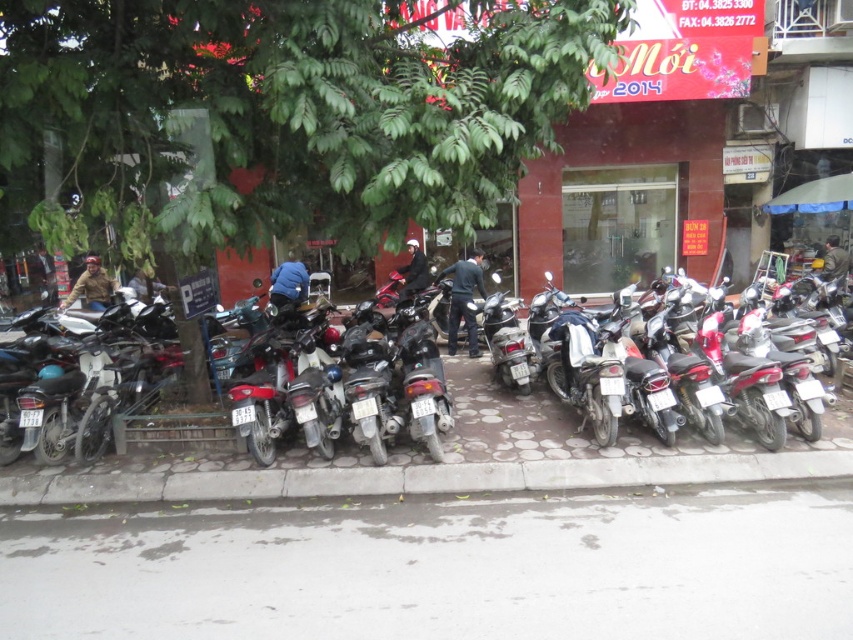
Question: Can you confirm if metallic silver motorcycle at center is bigger than matte brown helmet at left?

Choices:
 (A) yes
 (B) no

Answer: (B)

Question: Where is green leafy tree at center located in relation to matte brown helmet at left in the image?

Choices:
 (A) below
 (B) above

Answer: (B)

Question: Which point is farther to the camera?

Choices:
 (A) matte brown helmet at left
 (B) dark blue fabric jacket at center

Answer: (A)

Question: In this image, where is green leafy tree at center located relative to gray concrete curb at lower center?

Choices:
 (A) right
 (B) left

Answer: (B)

Question: Which object appears closest to the camera in this image?

Choices:
 (A) gray concrete pavement at lower center
 (B) shiny black helmet at center

Answer: (A)

Question: Which object is the closest to the gray concrete pavement at lower center?

Choices:
 (A) metallic silver motorcycle at center
 (B) blue fabric bag at center
 (C) dark blue fabric jacket at center
 (D) shiny black helmet at center

Answer: (A)